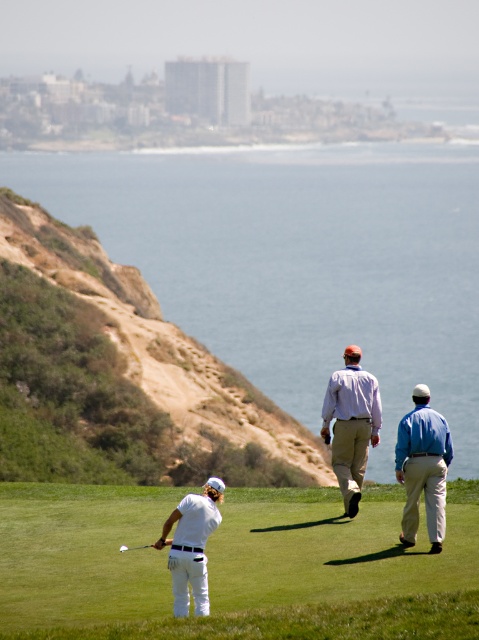
Between point (436, 540) and point (206, 611), which one is positioned behind?

The point (436, 540) is more distant.

Which is in front, point (398, 444) or point (192, 566)?

Point (192, 566)

Is point (417, 397) positioned after point (195, 508)?

Yes, it is.

Identify the location of blue cotton shirt at center. (x=422, y=467).

Which is in front, point (328, 566) or point (122, 548)?

Point (328, 566) is more forward.

Between point (48, 513) and point (121, 545), which one is positioned behind?

The point (48, 513) is behind.

Where is `white smooth golf club at lower center`? white smooth golf club at lower center is located at coordinates (234, 566).

This screenshot has width=479, height=640. What are the coordinates of `blue water at center` in the screenshot? It's located at (298, 260).

Does blue water at center have a smaller size compared to light purple shirt at center?

Incorrect, blue water at center is not smaller in size than light purple shirt at center.

Is point (475, 163) positioned in front of point (373, 381)?

No, it is not.

I want to click on blue water at center, so (298, 260).